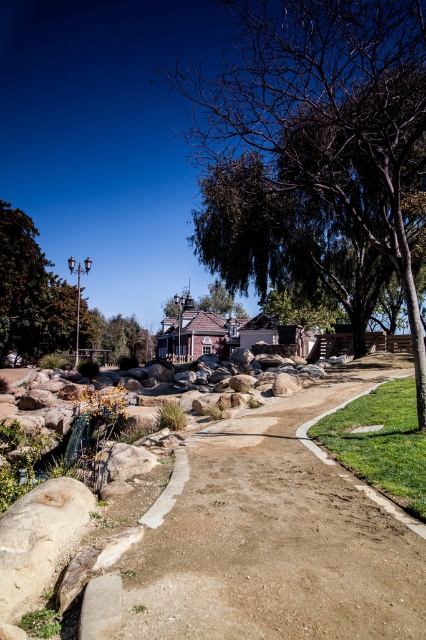
You are standing at the point with coordinates point (60, 312) and want to walk to the decorative lamp post near the water feature. Which direction should you move relative to the other point point (37, 493)?

Since point (37, 493) is in front of point (60, 312), you should move towards the direction of point (37, 493) to reach the decorative lamp post near the water feature.